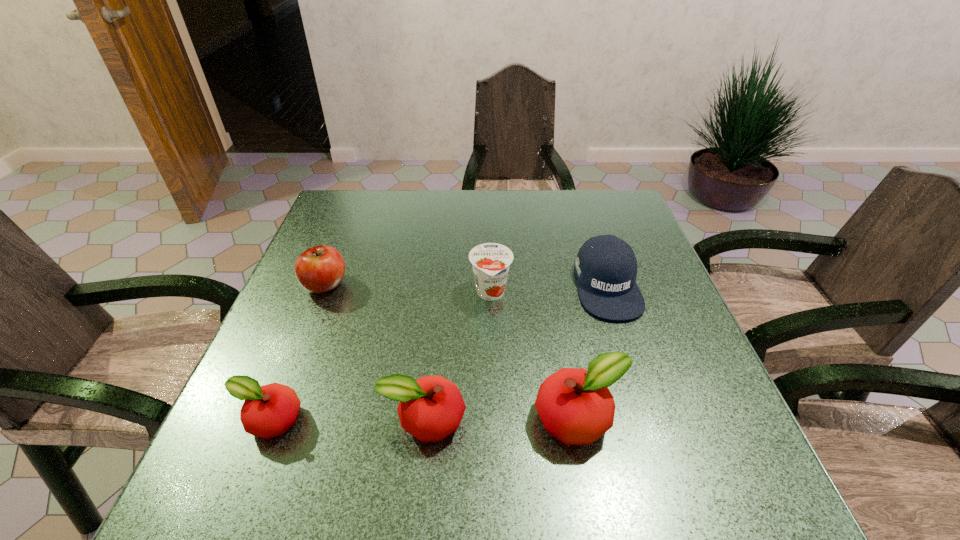
The width and height of the screenshot is (960, 540). Identify the location of object that is the fourth closest one to the yogurt. (319, 269).

Locate an element on the screen. apple that stands as the second closest to the shortest apple is located at coordinates (319, 269).

Identify the location of the closest apple to the shortest apple. (430, 408).

Identify the location of free space that satisfies the following two spatial constraints: 1. on the back side of the rightmost apple; 2. on the right side of the third apple from left to right. (424, 419).